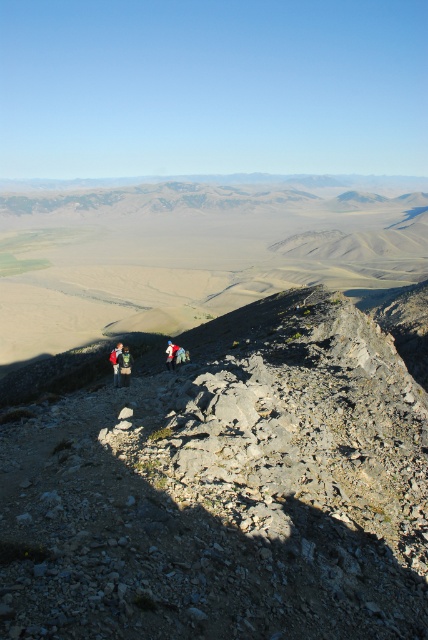
Looking at this image, you are a hiker who just arrived at the mountain trailhead. You see the camouflage fabric backpack at lower left. Where is the camouflage fabric backpack located in the image?

The camouflage fabric backpack at lower left is located at the 2D coordinates point (124, 365).

You are a hiker who wants to find the red backpack at center. Looking at the image, where should you look relative to the camouflage fabric backpack at lower left?

The camouflage fabric backpack at lower left is positioned on the right side of red backpack at center, so to find the red backpack at center, you should look to the left of the camouflage fabric backpack at lower left.

You are a hiker standing at the base of the mountain looking up. You see a camouflage fabric backpack at lower left and a blue fabric jacket at center. Which item is closer to you?

The camouflage fabric backpack at lower left is closer to you because it is in front of the blue fabric jacket at center.